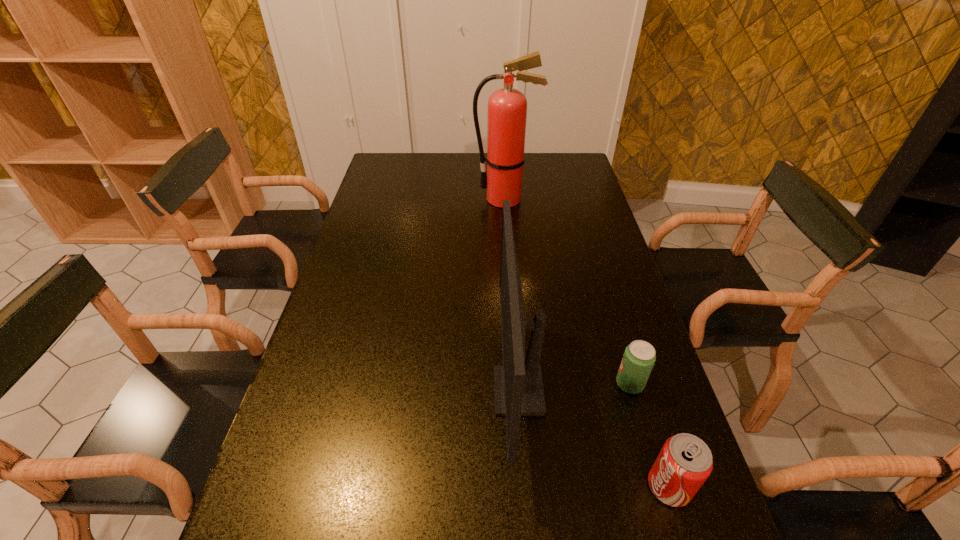
You are a GUI agent. You are given a task and a screenshot of the screen. Output one action in this format:
    pyautogui.click(x=<x>, y=<y>)
    Task: Click on the vacant region that satisfies the following two spatial constraints: 1. on the hose direction of the shortest object; 2. on the right side of the tallest object
    Image resolution: width=960 pixels, height=540 pixels.
    Given the screenshot: What is the action you would take?
    pyautogui.click(x=519, y=383)